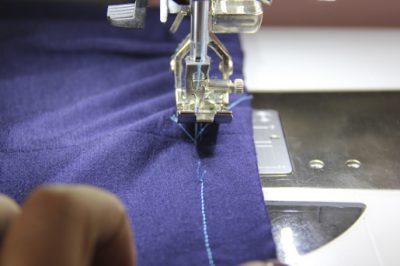
Find the location of a particular element. The height and width of the screenshot is (266, 400). sewing machine metal plate is located at coordinates (322, 136).